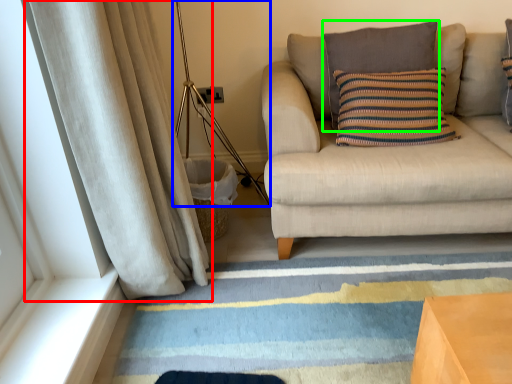
Question: Based on their relative distances, which object is nearer to curtain (highlighted by a red box)? Choose from lamp (highlighted by a blue box) and pillow (highlighted by a green box).

Choices:
 (A) lamp
 (B) pillow

Answer: (A)